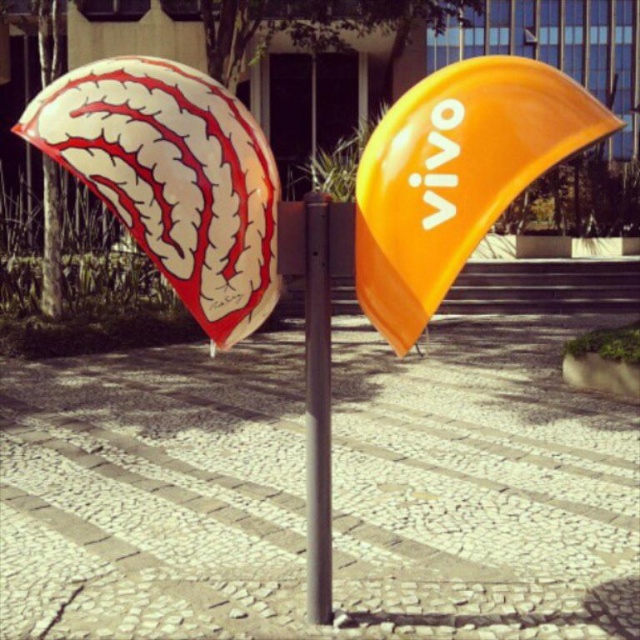
Can you confirm if orange matte/vinyl sign at upper right is positioned above metallic gray pole at center?

Yes, orange matte/vinyl sign at upper right is above metallic gray pole at center.

Image resolution: width=640 pixels, height=640 pixels. Describe the element at coordinates (456, 177) in the screenshot. I see `orange matte/vinyl sign at upper right` at that location.

Where is `orange matte/vinyl sign at upper right`? This screenshot has width=640, height=640. orange matte/vinyl sign at upper right is located at coordinates (456, 177).

You are a GUI agent. You are given a task and a screenshot of the screen. Output one action in this format:
    pyautogui.click(x=<x>, y=<y>)
    Task: Click on the orange matte/vinyl sign at upper right
    Image resolution: width=640 pixels, height=640 pixels.
    Given the screenshot: What is the action you would take?
    pyautogui.click(x=456, y=177)